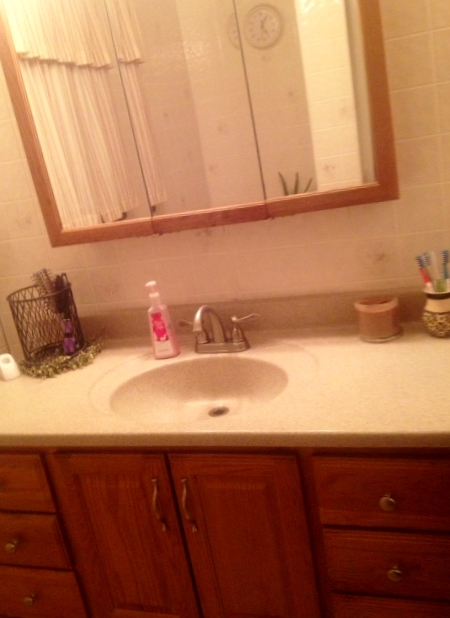
Find the location of a particular element. This screenshot has width=450, height=618. silver metallic sink drain is located at coordinates (220, 413).